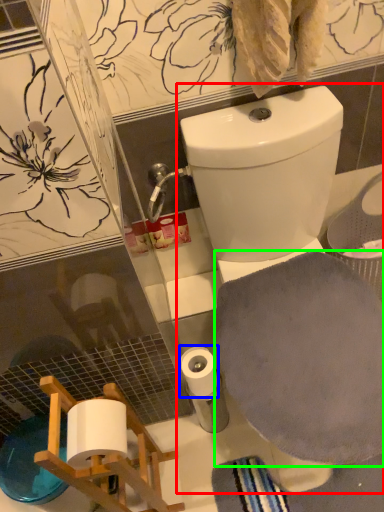
Question: Based on their relative distances, which object is farther from toilet (highlighted by a red box)? Choose from toilet paper (highlighted by a blue box) and bath towel (highlighted by a green box).

Choices:
 (A) toilet paper
 (B) bath towel

Answer: (A)